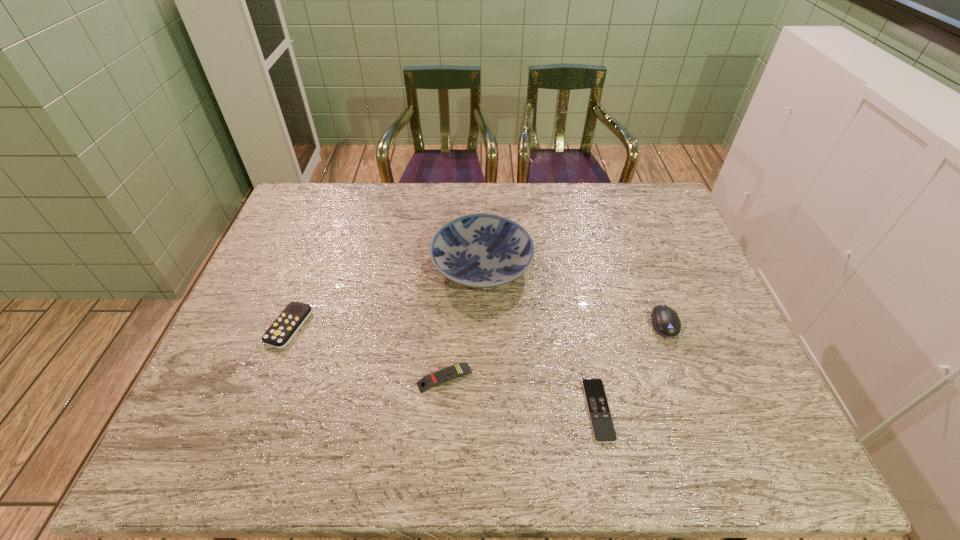
Where is `vacant position located 0.240m on the left of the farthest object`? The image size is (960, 540). vacant position located 0.240m on the left of the farthest object is located at coordinates (351, 266).

The image size is (960, 540). Identify the location of vacant area situated on the front of the rightmost object. (694, 404).

The image size is (960, 540). What are the coordinates of `free space located on the front of the leftmost object` in the screenshot? It's located at (238, 462).

Where is `vacant point located on the left of the second tallest remote control`? vacant point located on the left of the second tallest remote control is located at coordinates point(287,378).

Where is `vacant space positioned on the left of the shortest object`? This screenshot has height=540, width=960. vacant space positioned on the left of the shortest object is located at coordinates (471, 410).

At what (x,y) coordinates should I click in order to perform the action: click on object present at the near edge. Please return your answer as a coordinate pair (x, y). The width and height of the screenshot is (960, 540). Looking at the image, I should click on (603, 429).

Identify the location of object that is at the left edge. (280, 333).

Identify the location of object that is at the right edge. The height and width of the screenshot is (540, 960). pos(666,322).

In the image, there is a desktop. Identify the location of vacant space at the far edge. This screenshot has width=960, height=540. (564, 217).

Image resolution: width=960 pixels, height=540 pixels. In the image, there is a desktop. What are the coordinates of `vacant space at the near edge` in the screenshot? It's located at (521, 433).